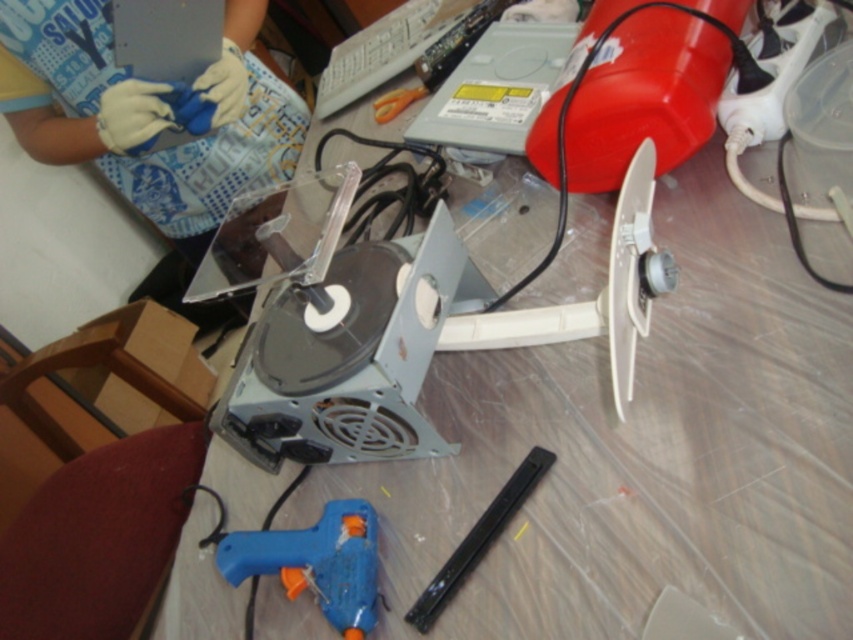
Can you confirm if white plastic fan at center is wider than blue plastic glue gun at lower center?

Yes, white plastic fan at center is wider than blue plastic glue gun at lower center.

Can you confirm if white plastic fan at center is shorter than blue plastic glue gun at lower center?

No, white plastic fan at center is not shorter than blue plastic glue gun at lower center.

The image size is (853, 640). Describe the element at coordinates (596, 296) in the screenshot. I see `white plastic fan at center` at that location.

This screenshot has height=640, width=853. I want to click on white plastic fan at center, so click(x=596, y=296).

Is white gloves at upper left below white plastic fan at center?

No.

Can you confirm if white gloves at upper left is smaller than white plastic fan at center?

Actually, white gloves at upper left might be larger than white plastic fan at center.

This screenshot has width=853, height=640. What are the coordinates of `white gloves at upper left` in the screenshot? It's located at click(146, 113).

The width and height of the screenshot is (853, 640). In order to click on white gloves at upper left in this screenshot , I will do `click(146, 113)`.

Who is lower down, white gloves at upper left or black plastic tool at lower center?

black plastic tool at lower center is below.

What do you see at coordinates (146, 113) in the screenshot? I see `white gloves at upper left` at bounding box center [146, 113].

Identify the location of white gloves at upper left. The width and height of the screenshot is (853, 640). (146, 113).